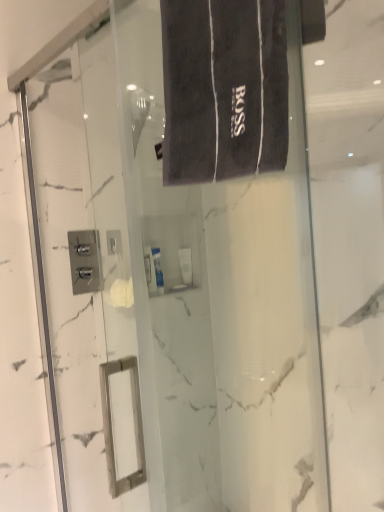
This screenshot has width=384, height=512. What do you see at coordinates (224, 89) in the screenshot?
I see `dark gray terry cloth bath towel at upper center` at bounding box center [224, 89].

At what (x,y) coordinates should I click in order to perform the action: click on white glossy tube at center, which is the 1th toiletry in back-to-front order. Please return your answer as a coordinate pair (x, y). The width and height of the screenshot is (384, 512). Looking at the image, I should click on (158, 270).

From the image's perspective, relative to white glossy tube at center, which is the 1th toiletry in back-to-front order, is dark gray terry cloth bath towel at upper center above or below?

Clearly, from the image's perspective, dark gray terry cloth bath towel at upper center is above white glossy tube at center, which is the 1th toiletry in back-to-front order.

Between point (231, 128) and point (156, 264), which one is positioned behind?

The point (156, 264) is farther.

Based on the photo, from a real-world perspective, who is located lower, dark gray terry cloth bath towel at upper center or white glossy tube at center, which is the 1th toiletry in back-to-front order?

In real-world perspective, white glossy tube at center, which is the 1th toiletry in back-to-front order, is lower.

How different are the orientations of dark gray terry cloth bath towel at upper center and white glossy tube at center, marked as the second toiletry in a front-to-back arrangement, in degrees?

90.7 degrees.

Is white glossy tube at center, marked as the second toiletry in a front-to-back arrangement, at the right side of white glossy tube at center, which ranks as the second toiletry in back-to-front order?

Yes, white glossy tube at center, marked as the second toiletry in a front-to-back arrangement, is to the right of white glossy tube at center, which ranks as the second toiletry in back-to-front order.

From a real-world perspective, between white glossy tube at center, marked as the second toiletry in a front-to-back arrangement, and white glossy tube at center, which ranks as the second toiletry in back-to-front order, who is vertically lower?

From a 3D spatial view, white glossy tube at center, marked as the second toiletry in a front-to-back arrangement, is below.

Can you tell me how much white glossy tube at center, marked as the second toiletry in a front-to-back arrangement, and white glossy tube at center, which ranks as the second toiletry in back-to-front order, differ in facing direction?

0.00492 degrees.

From the picture: Is white glossy tube at center, marked as the second toiletry in a front-to-back arrangement, not near white glossy tube at center, which ranks as the second toiletry in back-to-front order?

No, there isn't a large distance between white glossy tube at center, marked as the second toiletry in a front-to-back arrangement, and white glossy tube at center, which ranks as the second toiletry in back-to-front order.

Is white glossy tube at center, the first toiletry from the front, turned away from white glossy tube at center, which is the 1th toiletry in back-to-front order?

No, white glossy tube at center, the first toiletry from the front,'s orientation is not away from white glossy tube at center, which is the 1th toiletry in back-to-front order.

What's the angular difference between white glossy tube at center, which ranks as the second toiletry in back-to-front order, and white glossy tube at center, which is the 1th toiletry in back-to-front order,'s facing directions?

The angular difference between white glossy tube at center, which ranks as the second toiletry in back-to-front order, and white glossy tube at center, which is the 1th toiletry in back-to-front order, is 0.00492 degrees.

From a real-world perspective, is white glossy tube at center, the first toiletry from the front, physically below white glossy tube at center, marked as the second toiletry in a front-to-back arrangement?

No.

Is white glossy tube at center, marked as the second toiletry in a front-to-back arrangement, surrounded by white glossy tube at center, the first toiletry from the front?

Definitely not — white glossy tube at center, marked as the second toiletry in a front-to-back arrangement, is not inside white glossy tube at center, the first toiletry from the front.

Is white glossy tube at center, which ranks as the second toiletry in back-to-front order, positioned in front of dark gray terry cloth bath towel at upper center?

No.

Does white glossy tube at center, which ranks as the second toiletry in back-to-front order, have a smaller size compared to dark gray terry cloth bath towel at upper center?

Yes, white glossy tube at center, which ranks as the second toiletry in back-to-front order, is smaller than dark gray terry cloth bath towel at upper center.

From the image's perspective, which is above, white glossy tube at center, which ranks as the second toiletry in back-to-front order, or dark gray terry cloth bath towel at upper center?

dark gray terry cloth bath towel at upper center.

Considering the relative positions of white glossy tube at center, which is the 1th toiletry in back-to-front order, and dark gray terry cloth bath towel at upper center in the image provided, is white glossy tube at center, which is the 1th toiletry in back-to-front order, to the right of dark gray terry cloth bath towel at upper center from the viewer's perspective?

Incorrect, white glossy tube at center, which is the 1th toiletry in back-to-front order, is not on the right side of dark gray terry cloth bath towel at upper center.

From the image's perspective, which is above, white glossy tube at center, which is the 1th toiletry in back-to-front order, or dark gray terry cloth bath towel at upper center?

dark gray terry cloth bath towel at upper center appears higher in the image.

Can you confirm if white glossy tube at center, which is the 1th toiletry in back-to-front order, is thinner than dark gray terry cloth bath towel at upper center?

Indeed, white glossy tube at center, which is the 1th toiletry in back-to-front order, has a lesser width compared to dark gray terry cloth bath towel at upper center.

Is point (169, 132) behind point (152, 292)?

No, (169, 132) is in front of (152, 292).

Consider the image. Is dark gray terry cloth bath towel at upper center inside or outside of white glossy tube at center, the first toiletry from the front?

dark gray terry cloth bath towel at upper center cannot be found inside white glossy tube at center, the first toiletry from the front.

Between dark gray terry cloth bath towel at upper center and white glossy tube at center, the first toiletry from the front, which one has smaller width?

white glossy tube at center, the first toiletry from the front, is thinner.

From a real-world perspective, which is physically above, dark gray terry cloth bath towel at upper center or white glossy tube at center, which ranks as the second toiletry in back-to-front order?

dark gray terry cloth bath towel at upper center.

You are a GUI agent. You are given a task and a screenshot of the screen. Output one action in this format:
    pyautogui.click(x=<x>, y=<y>)
    Task: Click on the 2nd toiletry behind the dark gray terry cloth bath towel at upper center
    This screenshot has height=512, width=384.
    Given the screenshot: What is the action you would take?
    coord(158,270)

In the image, there is a white glossy tube at center, which ranks as the second toiletry in back-to-front order. Identify the location of toiletry below it (from the image's perspective). (158, 270).

Estimate the real-world distances between objects in this image. Which object is further from dark gray terry cloth bath towel at upper center, white glossy tube at center, the first toiletry from the front, or white glossy tube at center, marked as the second toiletry in a front-to-back arrangement?

white glossy tube at center, marked as the second toiletry in a front-to-back arrangement.

Which object lies further to the anchor point white glossy tube at center, which is the 1th toiletry in back-to-front order, white glossy tube at center, which ranks as the second toiletry in back-to-front order, or dark gray terry cloth bath towel at upper center?

Among the two, dark gray terry cloth bath towel at upper center is located further to white glossy tube at center, which is the 1th toiletry in back-to-front order.

Considering their positions, is dark gray terry cloth bath towel at upper center positioned closer to white glossy tube at center, which is the 1th toiletry in back-to-front order, than white glossy tube at center, which ranks as the second toiletry in back-to-front order?

The object closer to white glossy tube at center, which is the 1th toiletry in back-to-front order, is white glossy tube at center, which ranks as the second toiletry in back-to-front order.

Considering their positions, is dark gray terry cloth bath towel at upper center positioned further to white glossy tube at center, the first toiletry from the front, than white glossy tube at center, marked as the second toiletry in a front-to-back arrangement?

dark gray terry cloth bath towel at upper center lies further to white glossy tube at center, the first toiletry from the front, than the other object.

Based on their spatial positions, is white glossy tube at center, which is the 1th toiletry in back-to-front order, or dark gray terry cloth bath towel at upper center closer to white glossy tube at center, which ranks as the second toiletry in back-to-front order?

white glossy tube at center, which is the 1th toiletry in back-to-front order.

Considering their positions, is white glossy tube at center, marked as the second toiletry in a front-to-back arrangement, positioned closer to dark gray terry cloth bath towel at upper center than white glossy tube at center, the first toiletry from the front?

white glossy tube at center, the first toiletry from the front.

Locate an element on the screen. This screenshot has width=384, height=512. toiletry positioned between dark gray terry cloth bath towel at upper center and white glossy tube at center, which is the 1th toiletry in back-to-front order, from near to far is located at coordinates (150, 269).